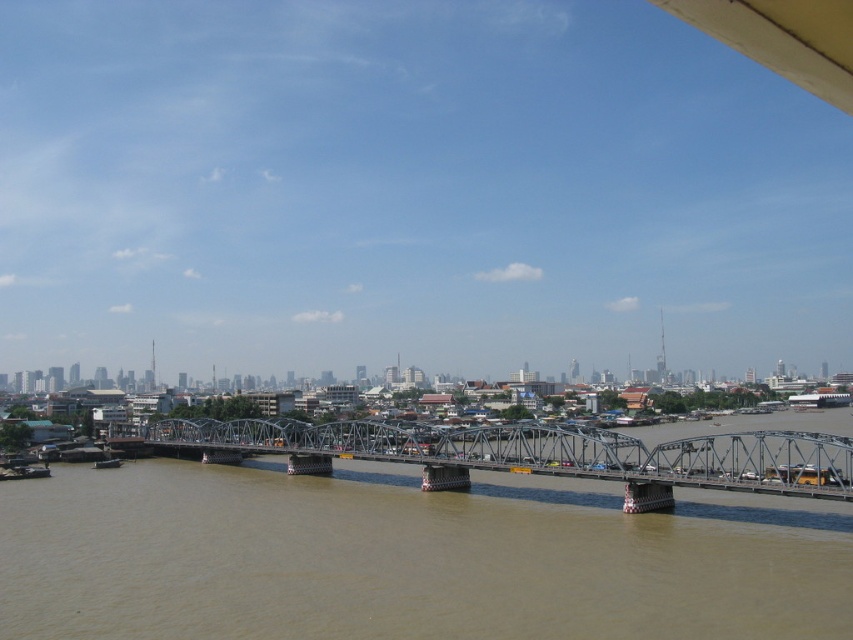
You are a drone operator planning to film the brown sedimentary river at center and the metallic steel bridge at center from above. Since the drone has a limited battery life, you want to ensure you can capture both objects in a single shot. Based on their positions, is this possible?

The brown sedimentary river at center is below the metallic steel bridge at center, so yes, capturing both in a single shot from above is possible as the bridge spans over the river.

Consider the image. You are standing on the left bank of the river and want to cross to the right bank. The metallic steel bridge at center is your only option. However, you notice the brown sedimentary river at center flows from left to right. Will the current of the river affect your ability to cross the bridge?

The brown sedimentary river at center flows from left to right, but since the metallic steel bridge at center is positioned over the river, the current will not hinder crossing as the bridge provides a stable path over the water.